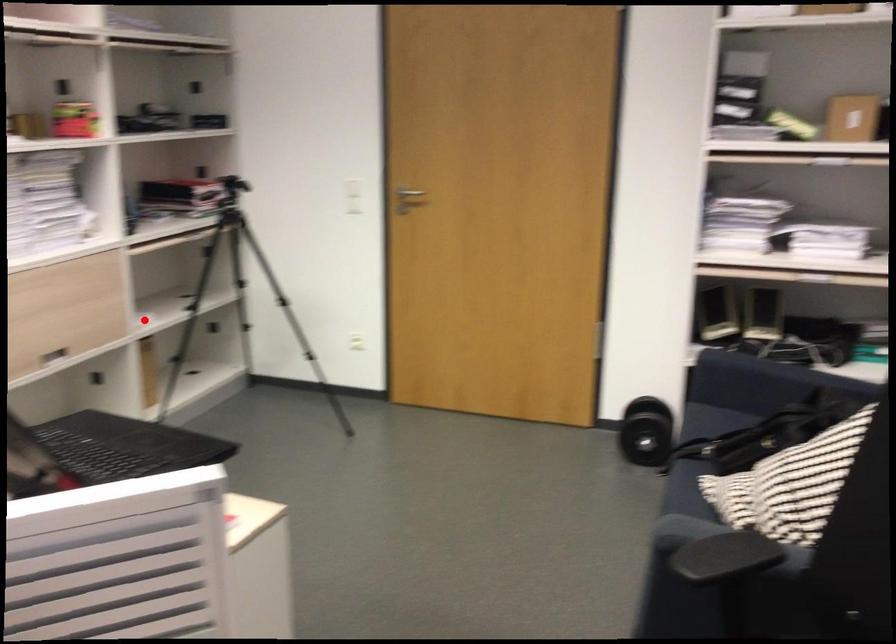
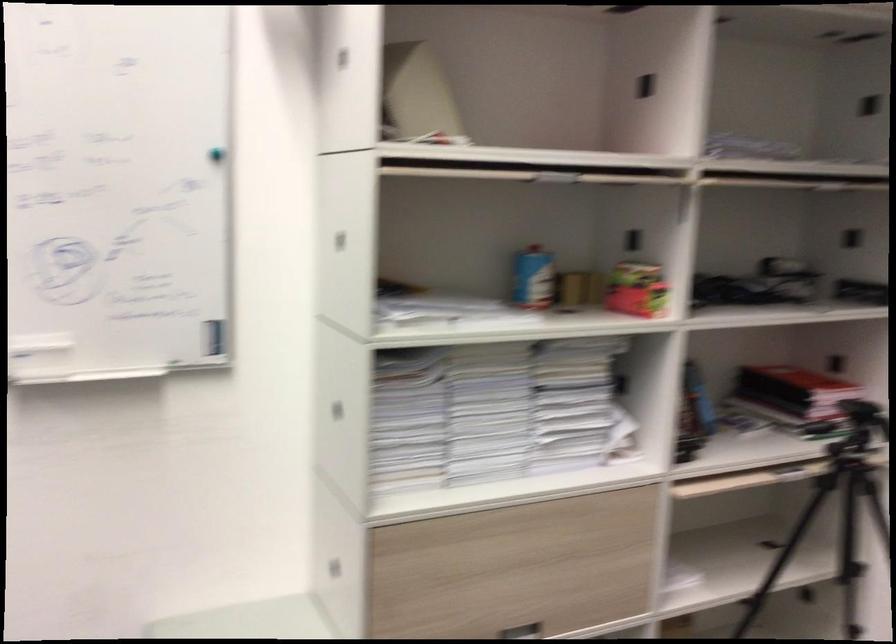
Question: I am providing you with two images of the same scene from different viewpoints. In image1, a red point is highlighted. Considering the same 3D point in image2, which of the following is correct?

Choices:
 (A) It is closer
 (B) It is farther

Answer: (A)